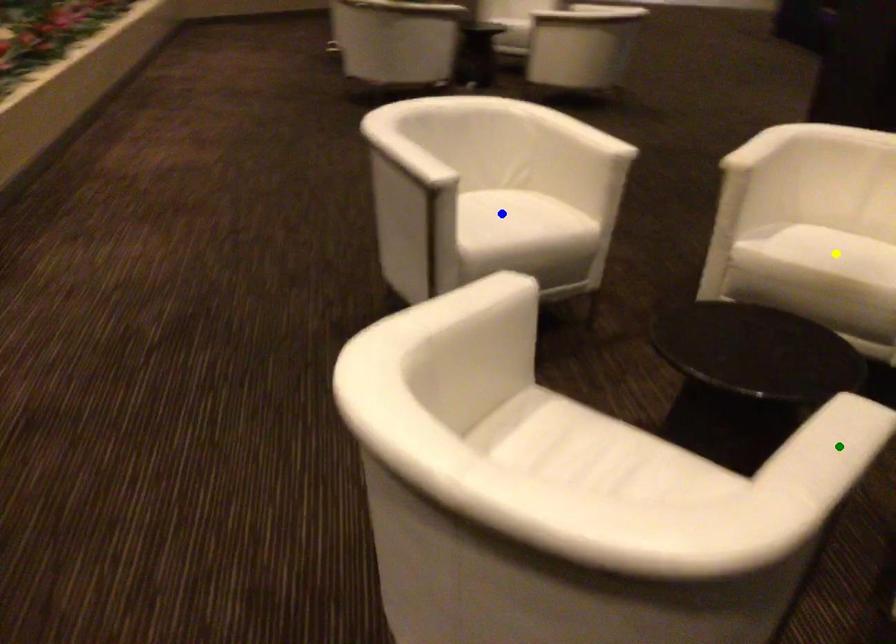
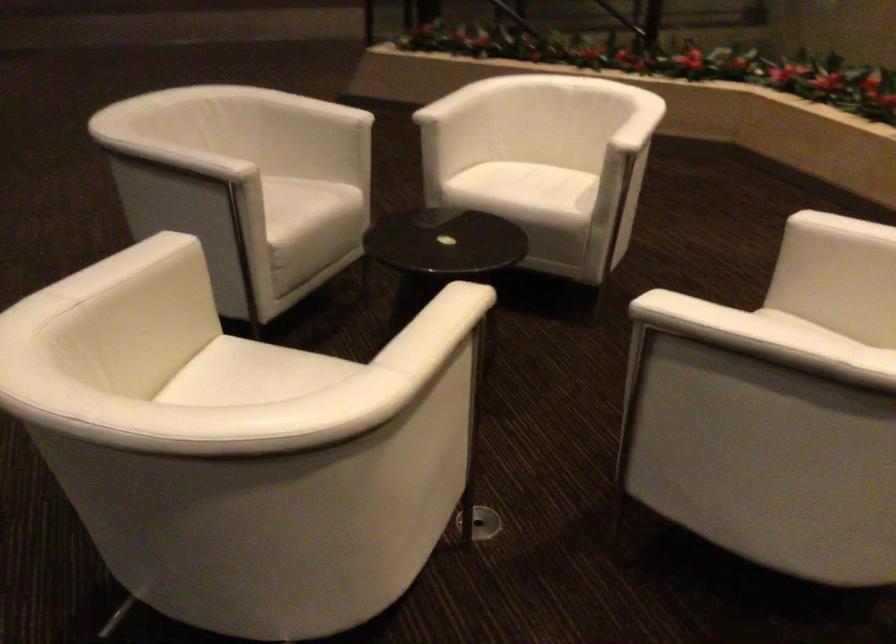
I am providing you with two images of the same scene from different viewpoints. Three points are marked in image1. Which point corresponds to a part or object that is occluded in image2?In image1, three points are marked. Which of them correspond to a part or object that is occluded in image2?Among the three points shown in image1, which one corresponds to a part or object that is no longer visible due to occlusion in image2?

yellow point, green point, blue point